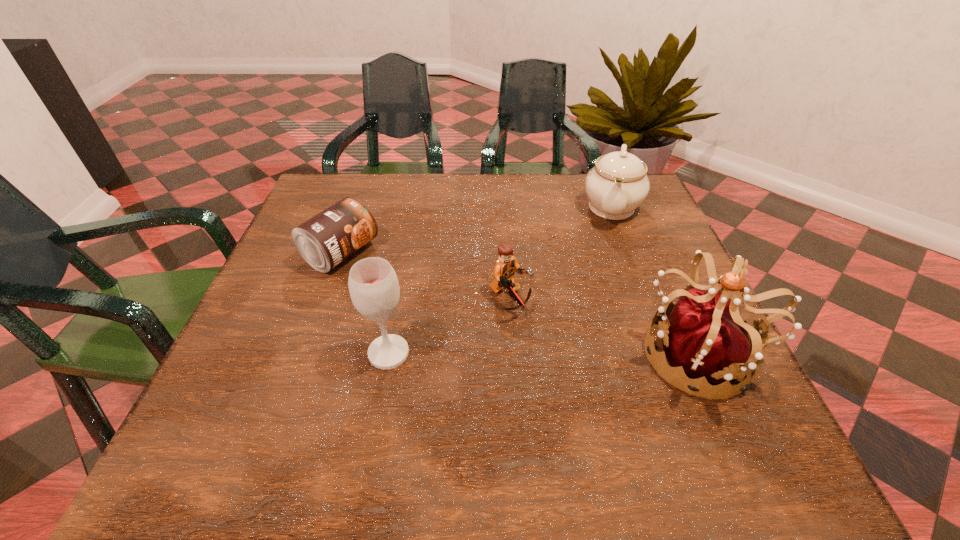
Where is `the fourth object from right to left`? This screenshot has height=540, width=960. the fourth object from right to left is located at coordinates 373,285.

Identify the location of tiara. The image size is (960, 540). pyautogui.click(x=704, y=336).

At what (x,y) coordinates should I click in order to perform the action: click on can. Please return your answer as a coordinate pair (x, y). Image resolution: width=960 pixels, height=540 pixels. Looking at the image, I should click on (328, 238).

The height and width of the screenshot is (540, 960). I want to click on Lego, so click(505, 268).

Find the location of a particular element. The width and height of the screenshot is (960, 540). the third tallest object is located at coordinates (617, 184).

The height and width of the screenshot is (540, 960). I want to click on vacant space situated on the left of the fourth object from right to left, so click(255, 353).

I want to click on vacant region located 0.400m on the front-facing side of the tiara, so click(426, 354).

Identify the location of free space located 0.090m on the front-facing side of the tiara. The height and width of the screenshot is (540, 960). pyautogui.click(x=592, y=354).

The image size is (960, 540). What are the coordinates of `free spot located 0.100m on the front-facing side of the tiara` in the screenshot? It's located at (587, 354).

This screenshot has width=960, height=540. I want to click on vacant region located 0.110m on the front label of the leftmost object, so point(405,287).